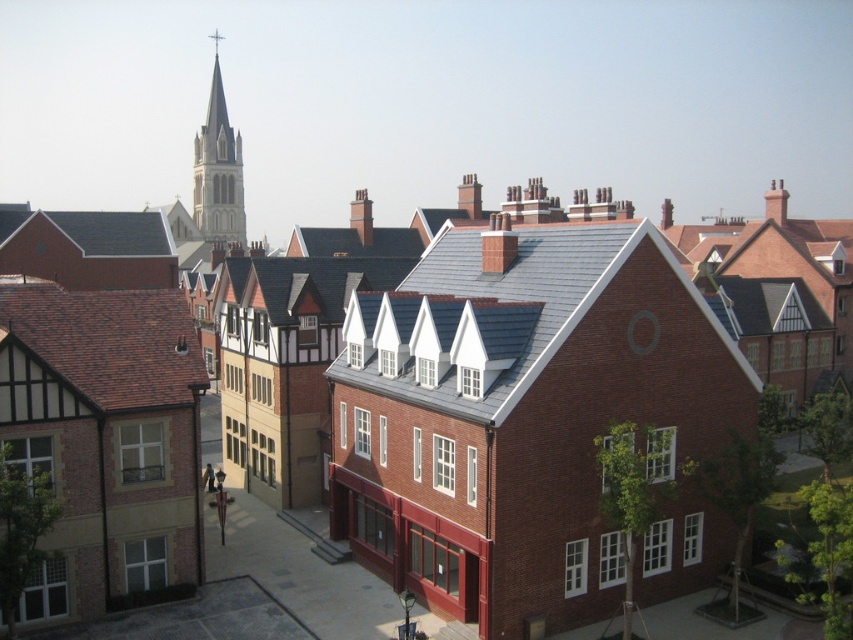
Can you confirm if brick building at center is positioned to the right of gray slate roof at center?

Incorrect, brick building at center is not on the right side of gray slate roof at center.

Is brick building at center to the left of gray slate roof at center from the viewer's perspective?

Yes, brick building at center is to the left of gray slate roof at center.

Is point (432, 273) behind point (459, 228)?

No, (432, 273) is in front of (459, 228).

Where is `brick building at center`? brick building at center is located at coordinates (520, 413).

At what (x,y) coordinates should I click in order to perform the action: click on gray slate roof at upper left. Please return your answer as a coordinate pair (x, y). The width and height of the screenshot is (853, 640). Looking at the image, I should click on (97, 230).

Looking at this image, who is more forward, [96,234] or [212,38]?

Point [96,234] is in front.

Between point (16, 209) and point (218, 38), which one is positioned behind?

The point (218, 38) is more distant.

I want to click on gray slate roof at upper left, so click(97, 230).

Is brown tile roof at left above smooth white stone spire at upper center?

No, brown tile roof at left is not above smooth white stone spire at upper center.

The image size is (853, 640). Find the location of `brown tile roof at left`. brown tile roof at left is located at coordinates (108, 342).

Locate an element on the screen. The image size is (853, 640). brown tile roof at left is located at coordinates (108, 342).